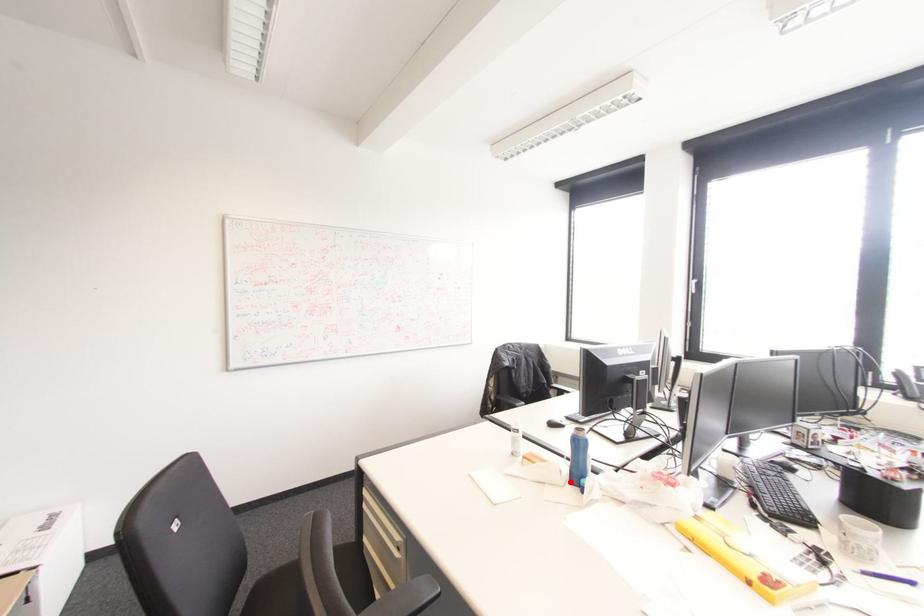
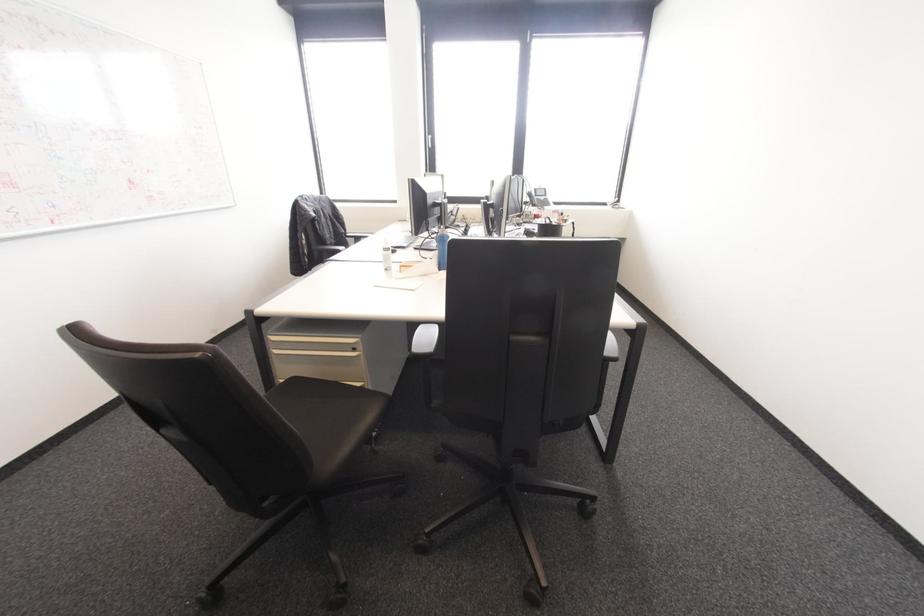
In the second image, find the point that corresponds to the highlighted location in the first image.

(440, 270)